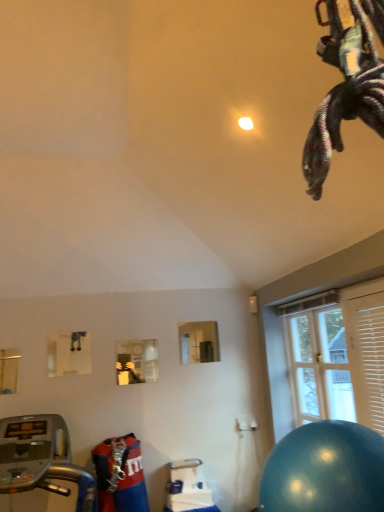
Question: Is shiny blue ball at lower right far from silver metallic treadmill at lower left?

Choices:
 (A) yes
 (B) no

Answer: (A)

Question: Does shiny blue ball at lower right have a greater height compared to silver metallic treadmill at lower left?

Choices:
 (A) yes
 (B) no

Answer: (B)

Question: From the image's perspective, is shiny blue ball at lower right located above silver metallic treadmill at lower left?

Choices:
 (A) yes
 (B) no

Answer: (A)

Question: Does shiny blue ball at lower right have a larger size compared to silver metallic treadmill at lower left?

Choices:
 (A) yes
 (B) no

Answer: (B)

Question: Is shiny blue ball at lower right turned away from silver metallic treadmill at lower left?

Choices:
 (A) no
 (B) yes

Answer: (A)

Question: Considering the relative positions of shiny blue ball at lower right and silver metallic treadmill at lower left in the image provided, is shiny blue ball at lower right to the right of silver metallic treadmill at lower left from the viewer's perspective?

Choices:
 (A) yes
 (B) no

Answer: (A)

Question: Considering the relative sizes of clear glass door at right and shiny blue ball at lower right in the image provided, is clear glass door at right wider than shiny blue ball at lower right?

Choices:
 (A) yes
 (B) no

Answer: (B)

Question: Is shiny blue ball at lower right surrounded by clear glass door at right?

Choices:
 (A) yes
 (B) no

Answer: (B)

Question: Is clear glass door at right taller than shiny blue ball at lower right?

Choices:
 (A) yes
 (B) no

Answer: (A)

Question: Is clear glass door at right placed right next to shiny blue ball at lower right?

Choices:
 (A) yes
 (B) no

Answer: (B)

Question: Is clear glass door at right oriented towards shiny blue ball at lower right?

Choices:
 (A) yes
 (B) no

Answer: (B)

Question: Can we say clear glass door at right lies outside shiny blue ball at lower right?

Choices:
 (A) yes
 (B) no

Answer: (A)

Question: Does wooden blinds at right appear on the left side of clear glass door at right?

Choices:
 (A) no
 (B) yes

Answer: (A)